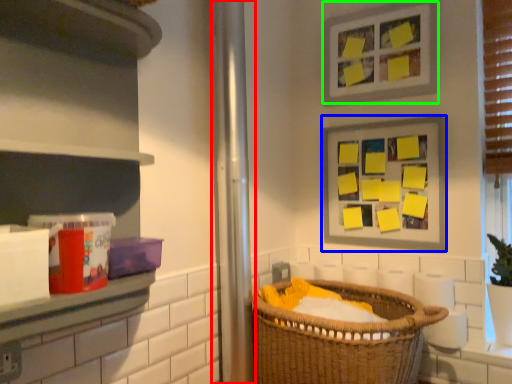
Question: Which object is positioned farthest from screen door (highlighted by a red box)? Select from picture frame (highlighted by a blue box) and picture frame (highlighted by a green box).

Choices:
 (A) picture frame
 (B) picture frame

Answer: (B)